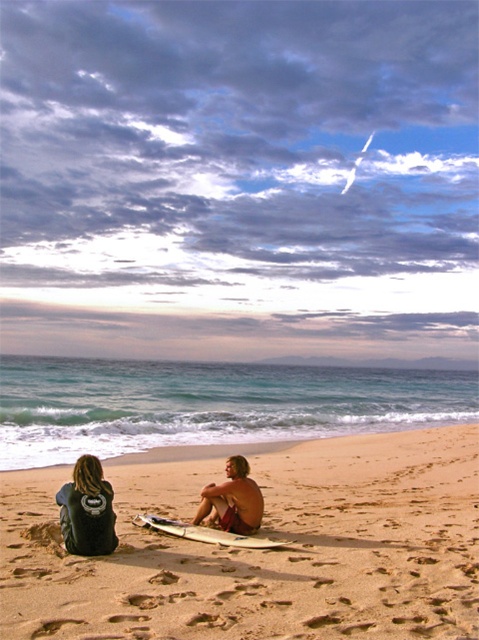
You are a photographer trying to capture the perfect shot of the beach scene. You want to position your camera so that the black leather jacket at lower left and the white glossy surfboard at center are both visible in the frame. Based on their positions, which object should appear to the left side of the frame?

The black leather jacket at lower left is positioned to the left of the white glossy surfboard at center, so in the frame, the black leather jacket at lower left will appear on the left side.

You are a surfer trying to choose a surfboard to ride the waves. Both the smooth sand surfboard at center and the white glossy surfboard at center are available. Which one is bigger?

The smooth sand surfboard at center is larger in size than the white glossy surfboard at center, so the smooth sand surfboard at center is bigger.